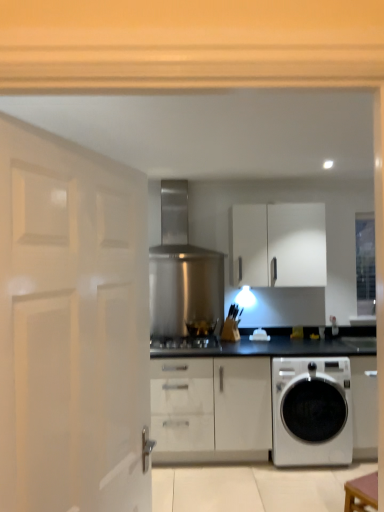
Locate an element on the screen. This screenshot has height=512, width=384. vacant space in black glass stove at center (from a real-world perspective) is located at coordinates (202, 334).